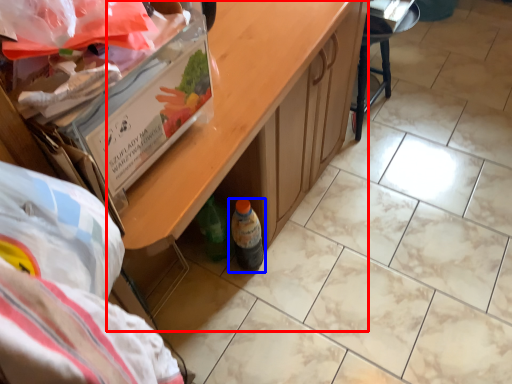
Question: Which of the following is the closest to the observer, table (highlighted by a red box) or bottle (highlighted by a blue box)?

Choices:
 (A) table
 (B) bottle

Answer: (A)